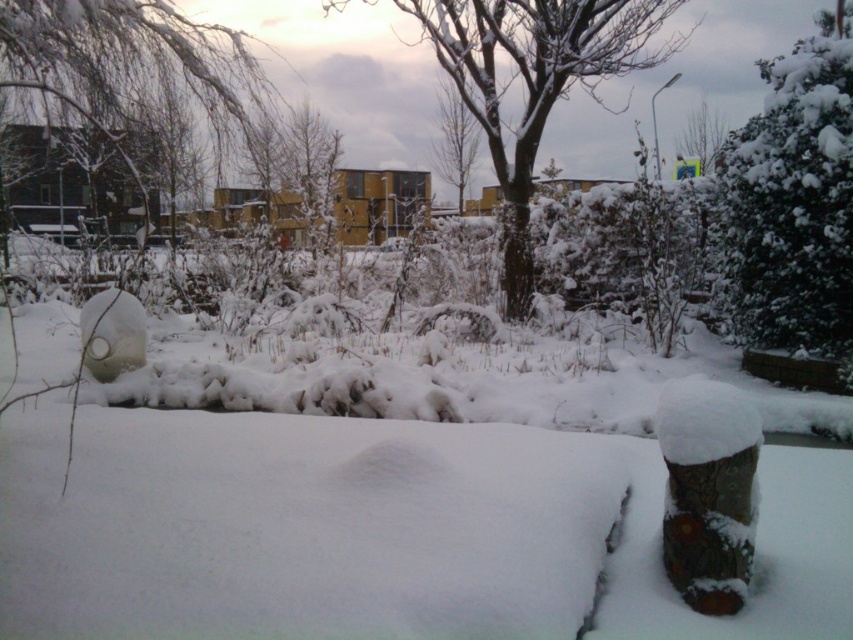
You are a gardener planning to plant a new tree between the white fluffy bush at upper right and the bare branches at center. The tree requires a minimum of 5 meters of space between it and any existing plants. Is the current distance sufficient for planting?

The distance between the white fluffy bush at upper right and the bare branches at center is 10.16 meters. Since the required minimum space is 5 meters, the current distance is sufficient for planting the new tree.

You are an observer looking at the winter scene. You notice the white fluffy bush at upper right and the smooth bark tree at upper center. Which object is located higher up in the image?

The white fluffy bush at upper right is positioned over the smooth bark tree at upper center, so it is higher up in the image.

You are an observer standing in the winter scene. You notice the white fluffy bush at upper right and the bare branches at center. Which object appears larger in size?

The white fluffy bush at upper right is bigger than the bare branches at center.